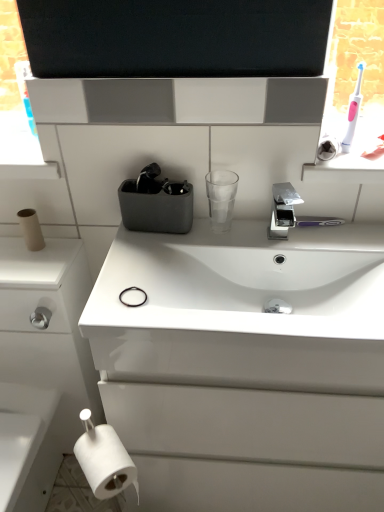
Identify the location of vacant area located to the right-hand side of transparent plastic cup at center. This screenshot has height=512, width=384. (276, 233).